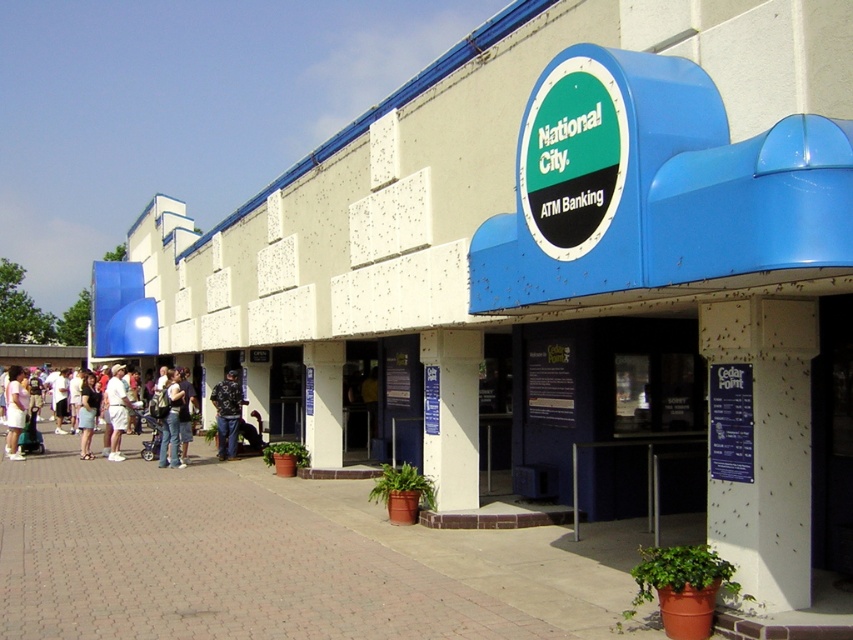
Question: Can you confirm if brick pavement at lower left is smaller than white cotton shirt at lower left?

Choices:
 (A) yes
 (B) no

Answer: (A)

Question: Which of these objects is positioned closest to the jeans at center?

Choices:
 (A) white cotton shirt at lower left
 (B) light blue denim shorts at lower left
 (C) brick pavement at lower left

Answer: (A)

Question: Among these points, which one is farthest from the camera?

Choices:
 (A) (9, 365)
 (B) (97, 406)
 (C) (120, 413)
 (D) (170, 416)

Answer: (A)

Question: Is camouflage jacket at center positioned before matte white shirt at lower left?

Choices:
 (A) yes
 (B) no

Answer: (A)

Question: Which of the following is the closest to the observer?

Choices:
 (A) white cotton shirt at lower left
 (B) brick pavement at lower left
 (C) camouflage jacket at center

Answer: (B)

Question: Observing the image, what is the correct spatial positioning of brick pavement at lower left in reference to camouflage jacket at center?

Choices:
 (A) right
 (B) left

Answer: (A)